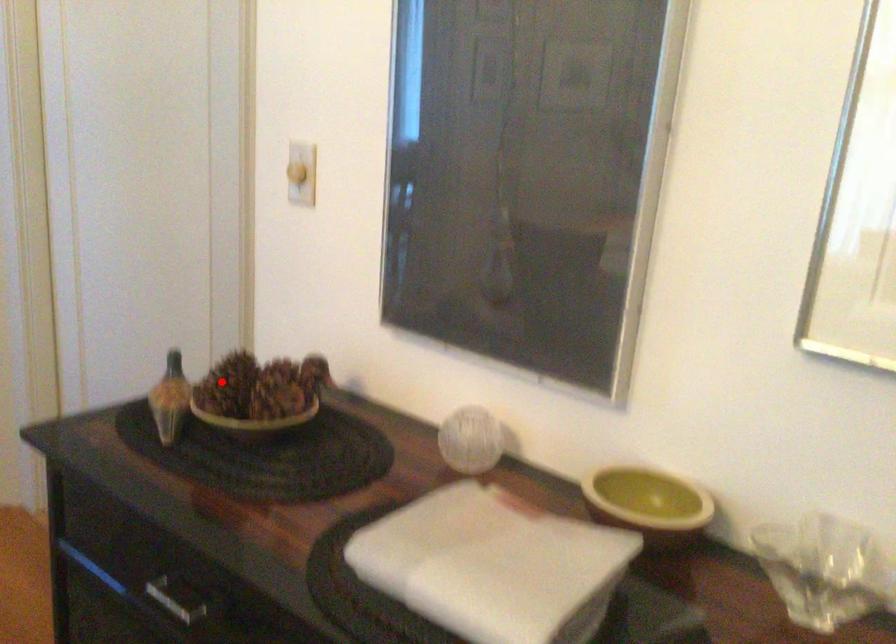
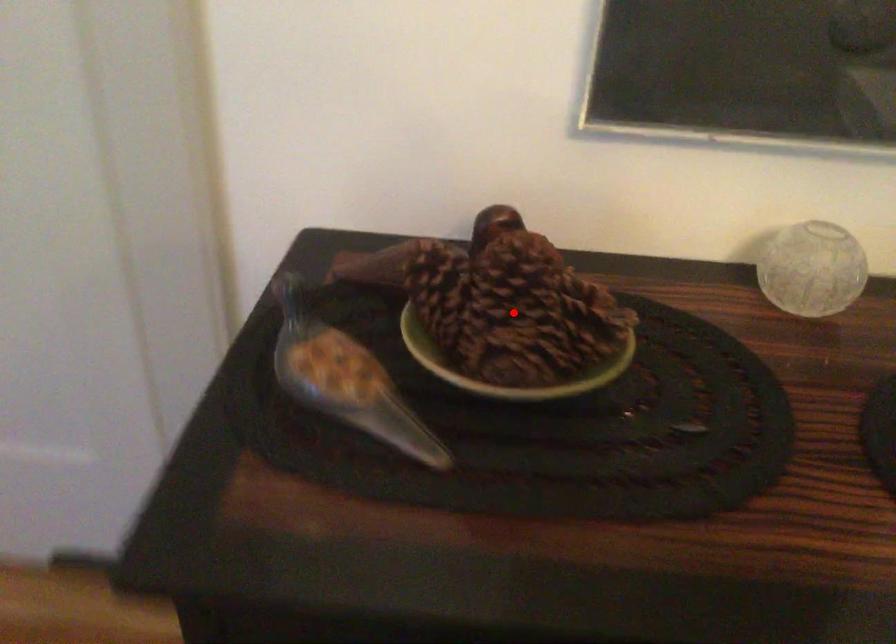
I am providing you with two images of the same scene from different viewpoints. A red point is marked on the first image and another point is marked on the second image. Are the points marked in image1 and image2 representing the same 3D position?

No